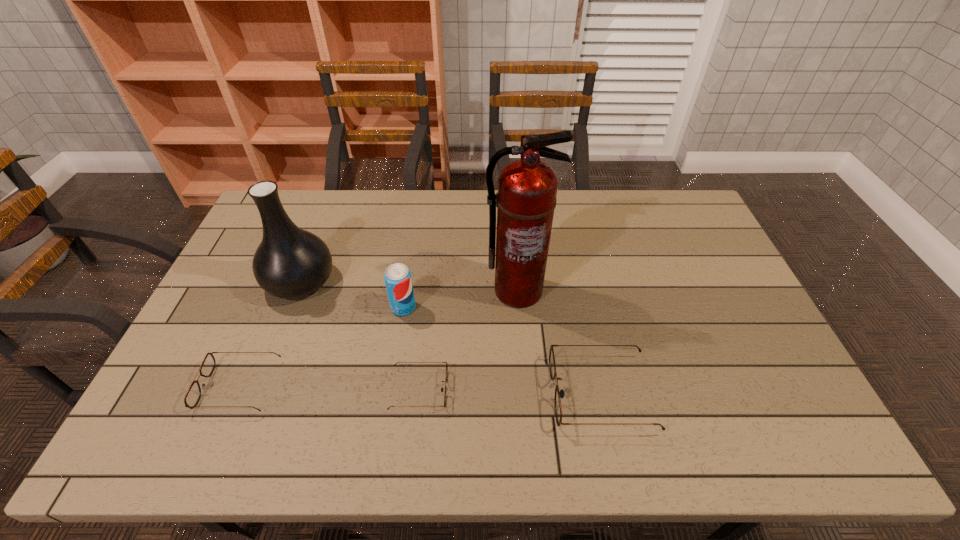
The width and height of the screenshot is (960, 540). What are the coordinates of `vacant region between the tallest object and the third shortest object` in the screenshot? It's located at (559, 342).

You are a GUI agent. You are given a task and a screenshot of the screen. Output one action in this format:
    pyautogui.click(x=<x>, y=<y>)
    Task: Click on the empty space between the second shortest sunglasses and the vase
    The width and height of the screenshot is (960, 540).
    Given the screenshot: What is the action you would take?
    pyautogui.click(x=270, y=334)

This screenshot has width=960, height=540. What are the coordinates of `empty space between the second shortest sunglasses and the tallest sunglasses` in the screenshot? It's located at (420, 389).

Find the location of a particular element. This screenshot has width=960, height=540. empty space that is in between the soda can and the second shortest sunglasses is located at coordinates (322, 347).

In order to click on empty space that is in between the soda can and the shortest sunglasses in this screenshot , I will do `click(411, 348)`.

Locate an element on the screen. The image size is (960, 540). empty location between the second sunglasses from left to right and the second tallest object is located at coordinates (360, 335).

At what (x,y) coordinates should I click in order to perform the action: click on vacant space that is in between the second tallest object and the second shortest sunglasses. Please return your answer as a coordinate pair (x, y). Looking at the image, I should click on (270, 334).

Identify the location of the closest object to the fifth tallest object. (289, 263).

Select which object is the fourth closest to the leftmost sunglasses. Please provide its 2D coordinates. Your answer should be formatted as a tuple, i.e. [(x, y)], where the tuple contains the x and y coordinates of a point satisfying the conditions above.

[(527, 188)]

The height and width of the screenshot is (540, 960). What are the coordinates of `the closest sunglasses to the leftmost sunglasses` in the screenshot? It's located at (446, 376).